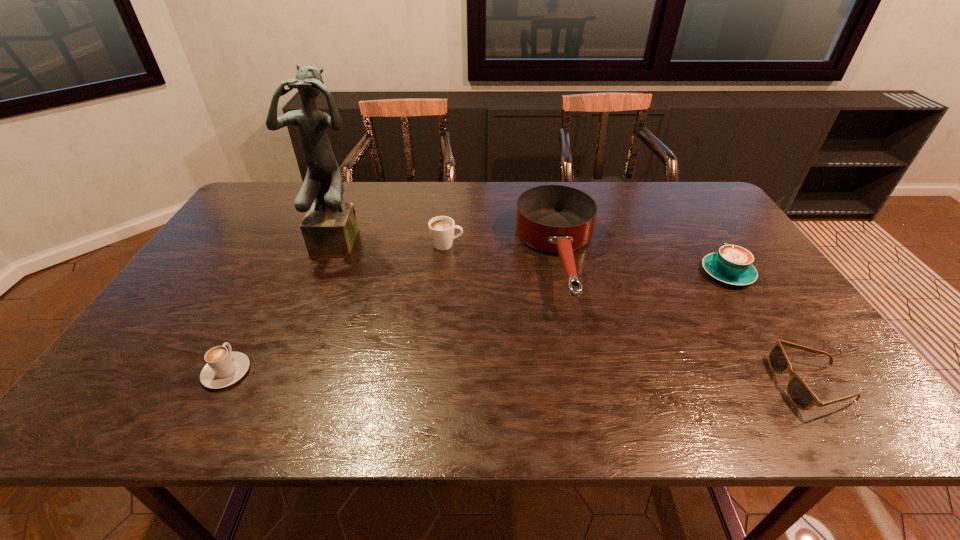
Locate an element on the screen. sculpture is located at coordinates (330, 226).

Where is `the third object from right to left`? Image resolution: width=960 pixels, height=540 pixels. the third object from right to left is located at coordinates (559, 219).

This screenshot has width=960, height=540. In order to click on pan in this screenshot , I will do `click(559, 219)`.

Locate an element on the screen. the third object from left to right is located at coordinates (441, 228).

Locate an element on the screen. the farthest cappuccino is located at coordinates (441, 228).

At what (x,y) coordinates should I click in order to perform the action: click on the rightmost cappuccino. Please return your answer as a coordinate pair (x, y). The image size is (960, 540). Looking at the image, I should click on (732, 264).

I want to click on the leftmost cappuccino, so pyautogui.click(x=224, y=368).

You are a GUI agent. You are given a task and a screenshot of the screen. Output one action in this format:
    pyautogui.click(x=<x>, y=<y>)
    Task: Click on the sunglasses
    This screenshot has width=960, height=540.
    Given the screenshot: What is the action you would take?
    pyautogui.click(x=799, y=393)

The image size is (960, 540). I want to click on vacant region located 0.140m on the face of the sculpture, so click(x=322, y=287).

Locate an element on the screen. vacant space located on the handle side of the fourth object from left to right is located at coordinates (581, 360).